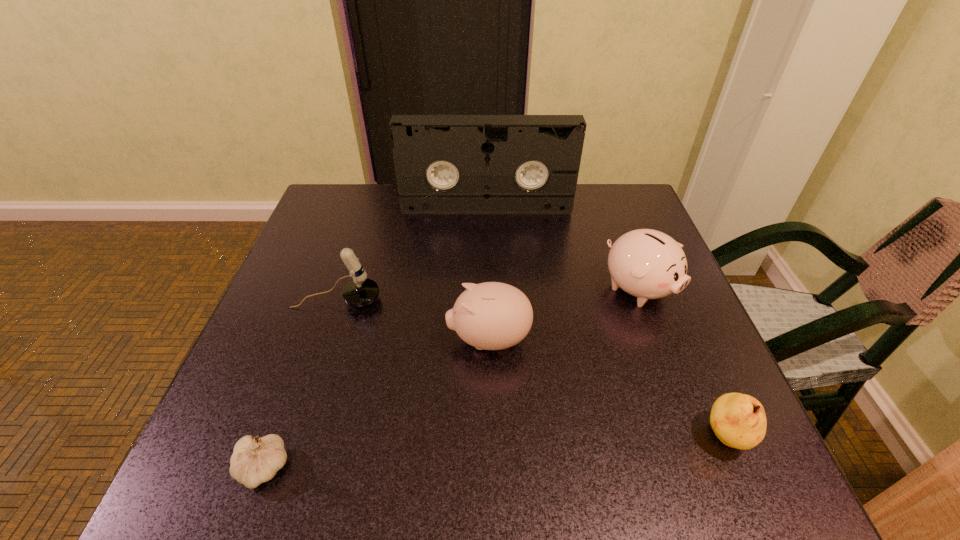
Choose which object is the nearest neighbor to the pear. Please provide its 2D coordinates. Your answer should be formatted as a tuple, i.e. [(x, y)], where the tuple contains the x and y coordinates of a point satisfying the conditions above.

[(648, 264)]

Image resolution: width=960 pixels, height=540 pixels. In order to click on object that is the closest to the videotape in this screenshot , I will do `click(648, 264)`.

Where is `free point that satisfies the following two spatial constraints: 1. on the side of the tallest object with visible spindles; 2. on the right side of the pear`? The height and width of the screenshot is (540, 960). free point that satisfies the following two spatial constraints: 1. on the side of the tallest object with visible spindles; 2. on the right side of the pear is located at coordinates (491, 437).

This screenshot has width=960, height=540. Identify the location of vacant space that satisfies the following two spatial constraints: 1. at the snout of the left piggy bank; 2. on the front side of the garlic. (491, 468).

Where is `vacant region that satisfies the following two spatial constraints: 1. on the back side of the right piggy bank; 2. on the left side of the garlic`? vacant region that satisfies the following two spatial constraints: 1. on the back side of the right piggy bank; 2. on the left side of the garlic is located at coordinates (328, 289).

You are a GUI agent. You are given a task and a screenshot of the screen. Output one action in this format:
    pyautogui.click(x=<x>, y=<y>)
    Task: Click on the blank space that satisfies the following two spatial constraints: 1. at the snout of the pear; 2. on the right side of the left piggy bank
    Image resolution: width=960 pixels, height=540 pixels.
    Given the screenshot: What is the action you would take?
    coord(491,437)